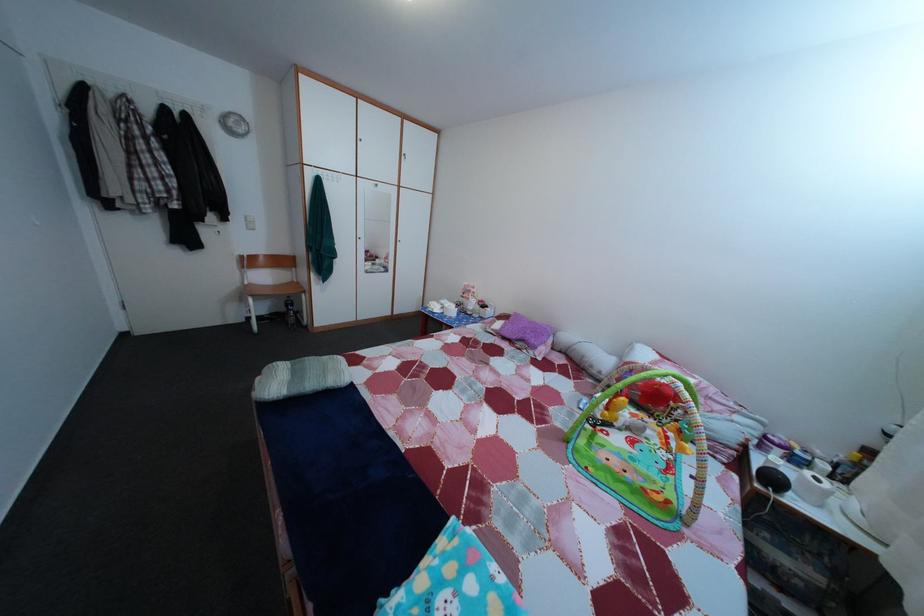
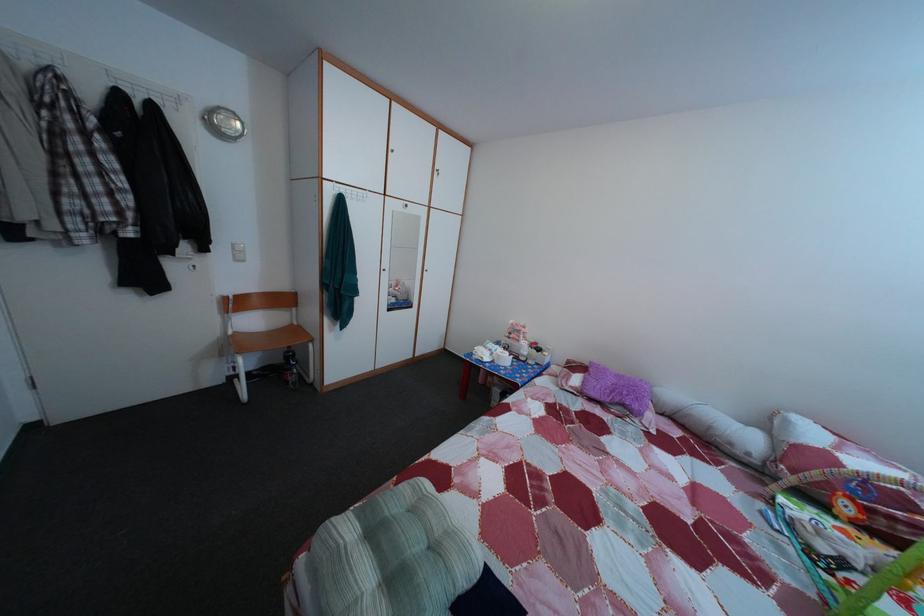
Question: The images are taken continuously from a first-person perspective. In which direction is your viewpoint rotating?

Choices:
 (A) Left
 (B) Right
 (C) Up
 (D) Down

Answer: (B)